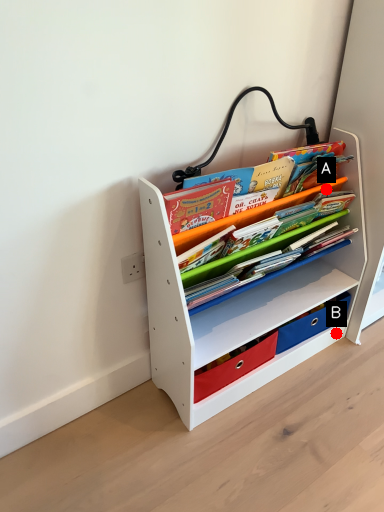
Question: Two points are circled on the image, labeled by A and B beside each circle. Among these points, which one is farthest from the camera?

Choices:
 (A) A is further
 (B) B is further

Answer: (B)